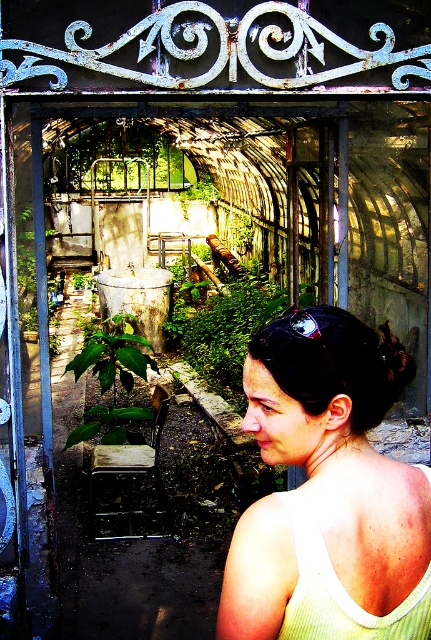
Question: Does light yellow knit tank top at center come behind green striped vest at upper right?

Choices:
 (A) yes
 (B) no

Answer: (B)

Question: Can you confirm if light yellow knit tank top at center is smaller than green striped vest at upper right?

Choices:
 (A) yes
 (B) no

Answer: (B)

Question: Is light yellow knit tank top at center positioned in front of green striped vest at upper right?

Choices:
 (A) yes
 (B) no

Answer: (A)

Question: Which point is closer to the camera?

Choices:
 (A) green striped vest at upper right
 (B) light yellow knit tank top at center

Answer: (B)

Question: Which object appears closest to the camera in this image?

Choices:
 (A) light yellow knit tank top at center
 (B) green striped vest at upper right

Answer: (A)